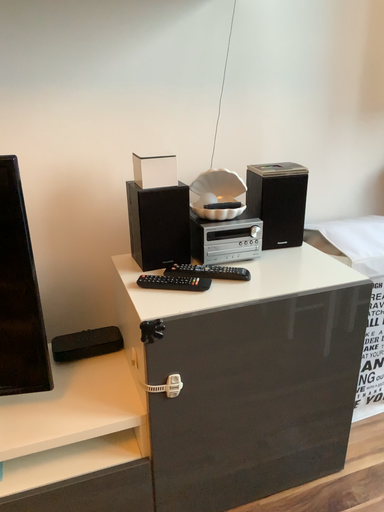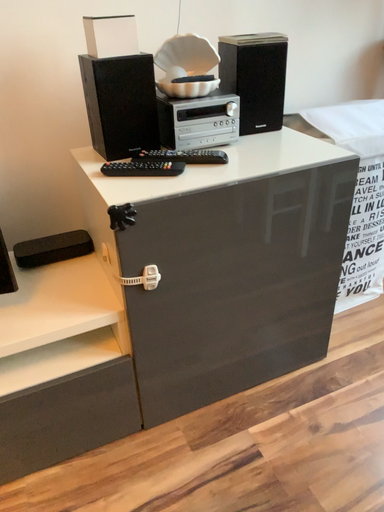
Question: Which way did the camera rotate in the video?

Choices:
 (A) rotated downward
 (B) rotated upward

Answer: (A)